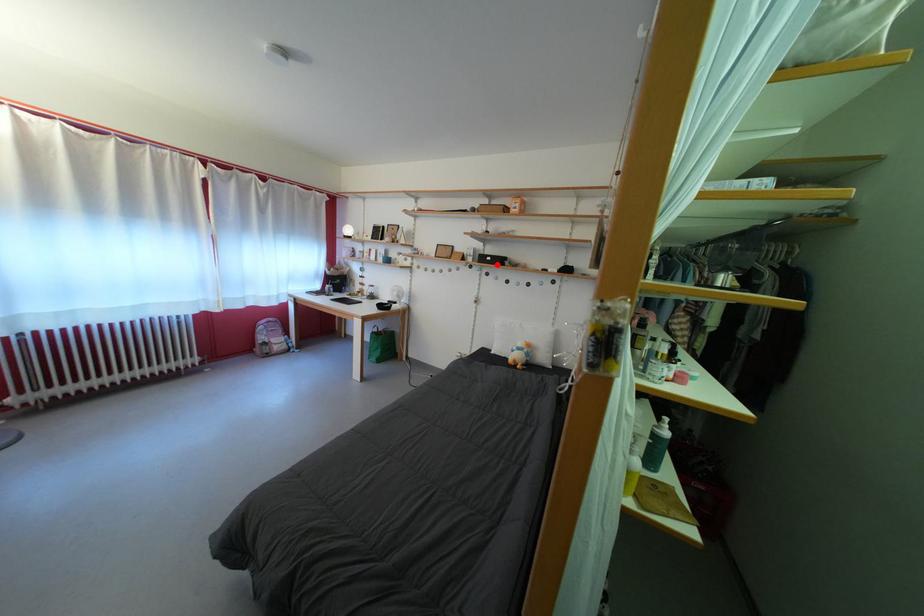
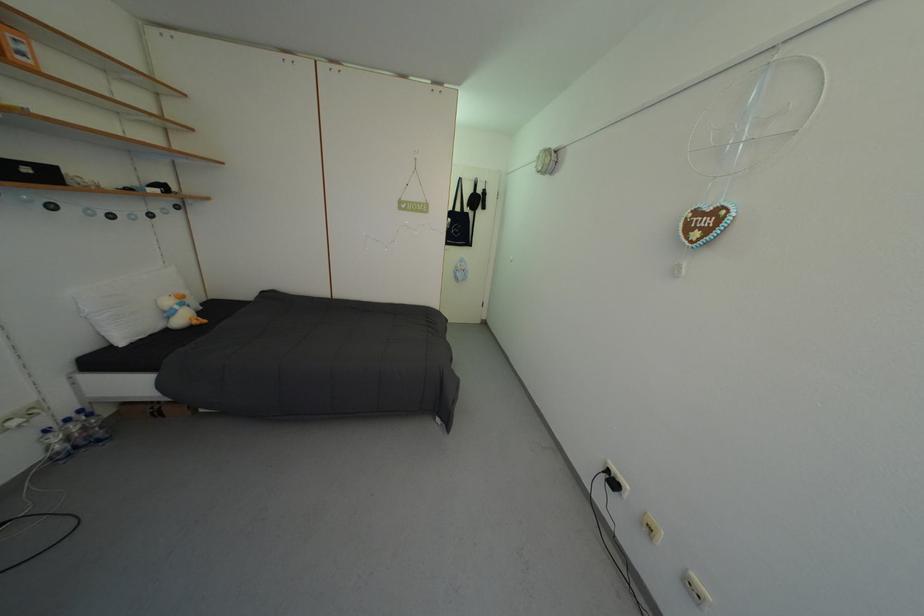
Question: I am providing you with two images of the same scene from different viewpoints. In image1, a red point is highlighted. Considering the same 3D point in image2, which of the following is correct?

Choices:
 (A) It is closer
 (B) It is farther

Answer: (B)